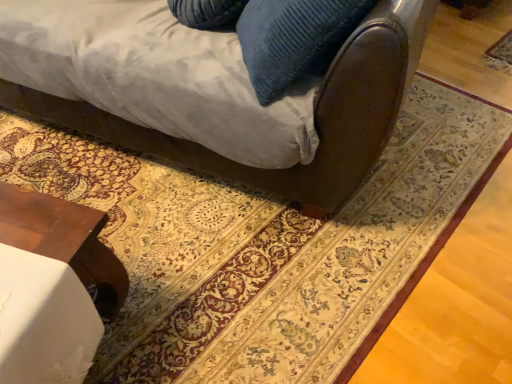
The image size is (512, 384). In order to click on brown leather couch at upper center in this screenshot , I will do `click(314, 114)`.

This screenshot has height=384, width=512. What do you see at coordinates (314, 114) in the screenshot?
I see `brown leather couch at upper center` at bounding box center [314, 114].

Find the location of `brown leather couch at upper center`. brown leather couch at upper center is located at coordinates (314, 114).